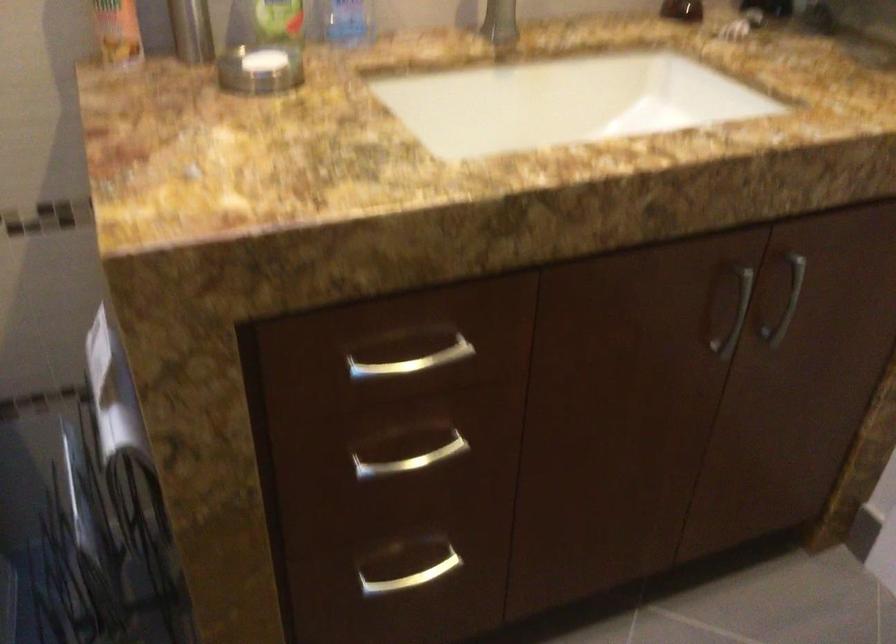
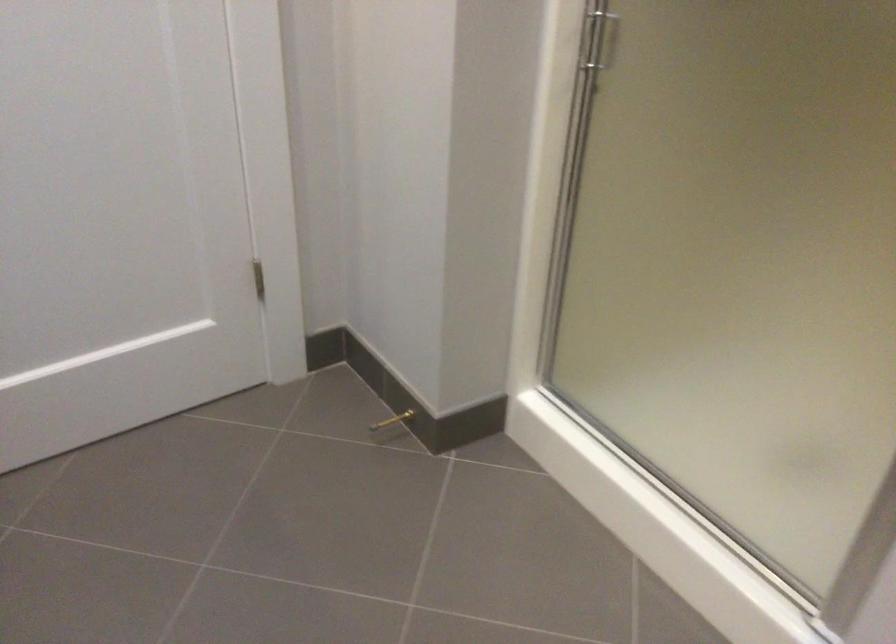
Based on the continuous images, in which direction is the camera rotating?

The rotation direction of the camera is right-down.